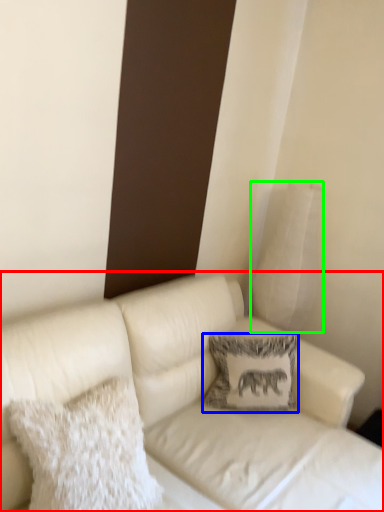
Question: Which object is positioned closest to studio couch (highlighted by a red box)? Select from pillow (highlighted by a blue box) and pillow (highlighted by a green box).

Choices:
 (A) pillow
 (B) pillow

Answer: (A)